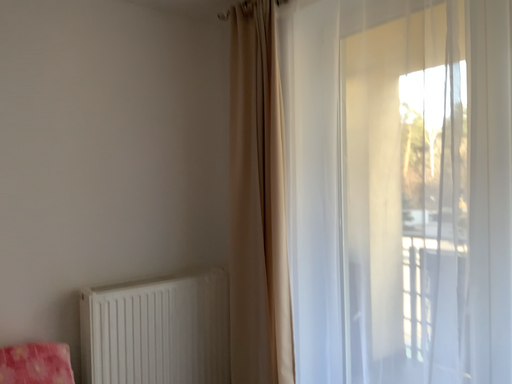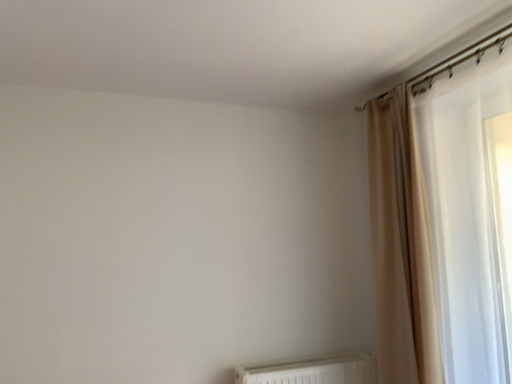
Question: How did the camera likely rotate when shooting the video?

Choices:
 (A) rotated downward
 (B) rotated upward

Answer: (B)